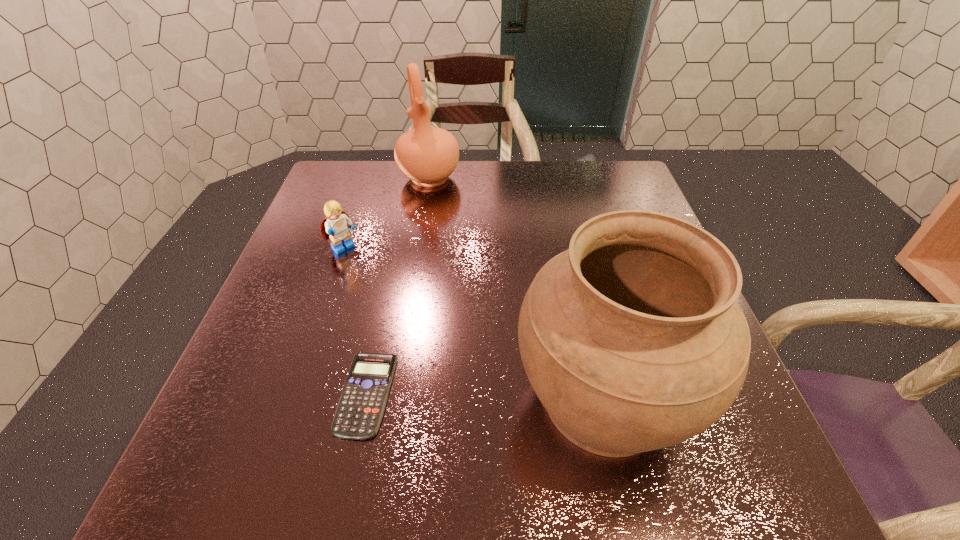
In order to click on vacant area that lies between the rightmost object and the pottery in this screenshot , I will do `click(516, 288)`.

At what (x,y) coordinates should I click in order to perform the action: click on free space between the pottery and the calculator. Please return your answer as a coordinate pair (x, y). Looking at the image, I should click on (397, 286).

The image size is (960, 540). What are the coordinates of `free point between the calculator and the rightmost object` in the screenshot? It's located at (485, 396).

Identify which object is located as the nearest to the shortest object. Please provide its 2D coordinates. Your answer should be formatted as a tuple, i.e. [(x, y)], where the tuple contains the x and y coordinates of a point satisfying the conditions above.

[(632, 339)]

The image size is (960, 540). Find the location of `the second closest object to the farthest object`. the second closest object to the farthest object is located at coordinates (632, 339).

Locate an element on the screen. Image resolution: width=960 pixels, height=540 pixels. free spot that satisfies the following two spatial constraints: 1. on the back side of the calculator; 2. on the left side of the pottery is located at coordinates (412, 178).